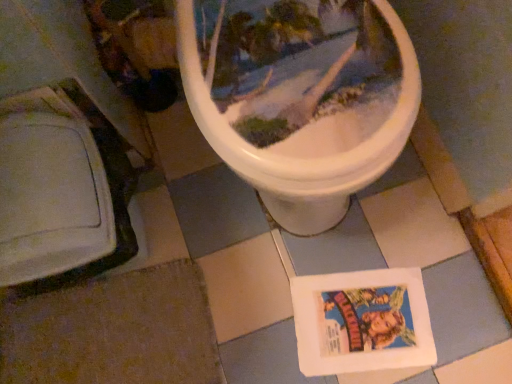
At what (x,y) coordinates should I click in order to perform the action: click on vacant region to the right of brown fabric at lower left. Please return your answer as a coordinate pair (x, y). This screenshot has width=512, height=384. Looking at the image, I should click on (272, 292).